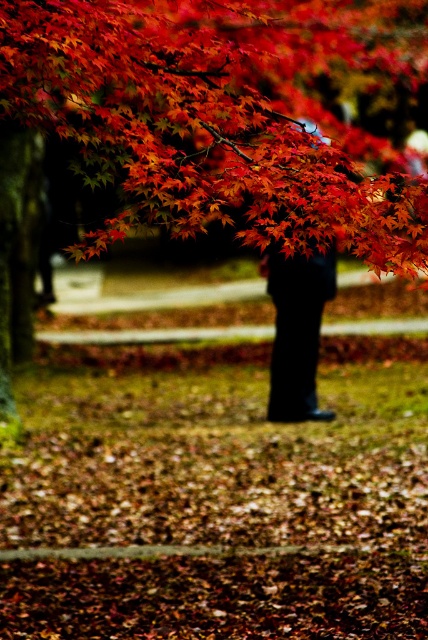
You are standing in the autumn scene and want to place a small decorative stone between the two points, point (64,112) and point (315,413). Which point should the stone be closer to if it needs to be placed in front of the other point?

The stone should be placed closer to point (64,112) because it is in front of point (315,413).

You are a photographer trying to capture the black matte pants at center and the shiny red maple leaves at upper center in the same frame. Based on their positions, which object is located to the right of the other?

The shiny red maple leaves at upper center is positioned on the right side of black matte pants at center.

You are an artist planning to paint this autumn scene. You want to ensure the shiny red maple leaves at upper center and the black matte pants at center are proportionally accurate. Which object should you paint smaller to maintain the scene proportions?

The shiny red maple leaves at upper center should be painted smaller than the black matte pants at center to maintain the scene proportions.